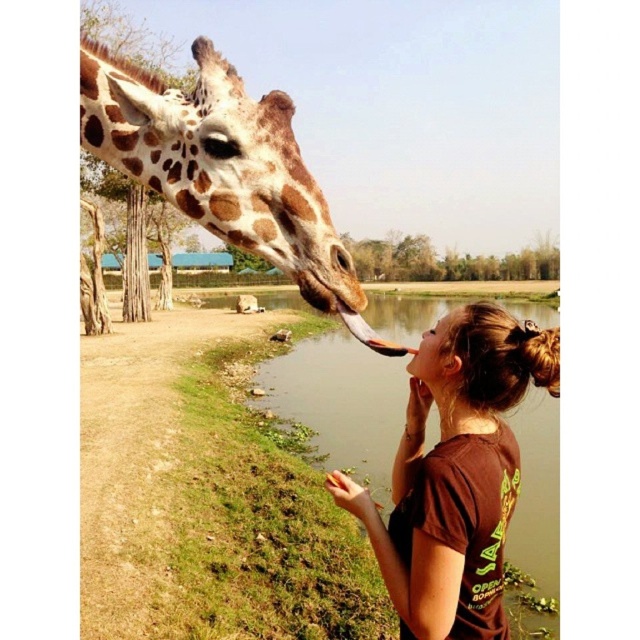
From the picture: Between brown matte shirt at center and spotted fur giraffe at upper left, which one is positioned lower?

brown matte shirt at center is below.

Is brown matte shirt at center to the left of spotted fur giraffe at upper left from the viewer's perspective?

No, brown matte shirt at center is not to the left of spotted fur giraffe at upper left.

Is point (531, 378) positioned before point (348, 276)?

No, (531, 378) is behind (348, 276).

Where is `brown matte shirt at center`? Image resolution: width=640 pixels, height=640 pixels. brown matte shirt at center is located at coordinates (456, 474).